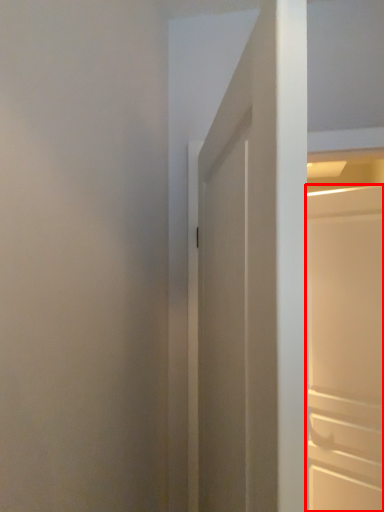
Question: From the image's perspective, where is door (annotated by the red box) located relative to door?

Choices:
 (A) below
 (B) above

Answer: (A)